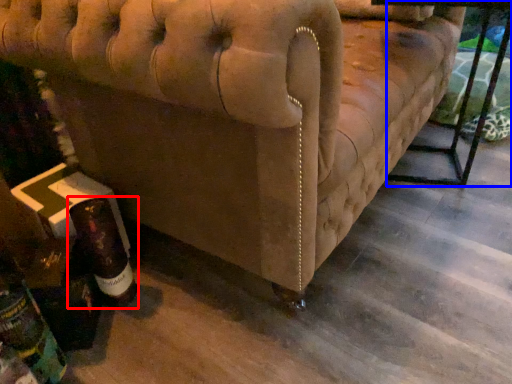
Question: Which of the following is the closest to the observer, bottle (highlighted by a red box) or table (highlighted by a blue box)?

Choices:
 (A) bottle
 (B) table

Answer: (A)